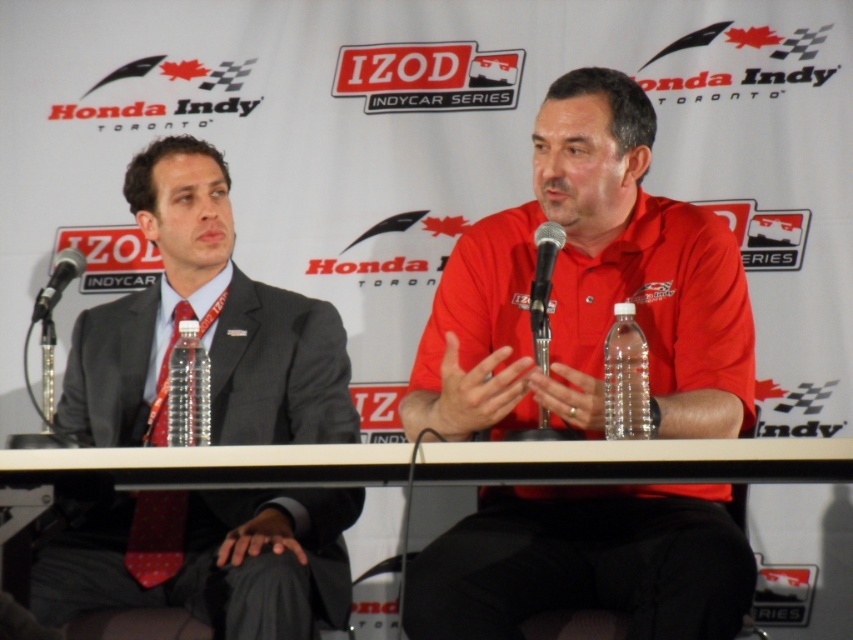
Does clear plastic bottle at center have a larger size compared to metallic silver microphone at center?

Indeed, clear plastic bottle at center has a larger size compared to metallic silver microphone at center.

Measure the distance from clear plastic bottle at center to metallic silver microphone at center.

clear plastic bottle at center and metallic silver microphone at center are 7.37 inches apart.

Measure the distance between clear plastic bottle at center and camera.

clear plastic bottle at center and camera are 2.42 meters apart from each other.

The height and width of the screenshot is (640, 853). What are the coordinates of `clear plastic bottle at center` in the screenshot? It's located at click(x=625, y=378).

Who is higher up, red dotted tie at left or black metallic microphone at left?

black metallic microphone at left

Describe the element at coordinates (155, 536) in the screenshot. The width and height of the screenshot is (853, 640). I see `red dotted tie at left` at that location.

I want to click on red dotted tie at left, so click(x=155, y=536).

Does matte red shirt at center appear under black metallic microphone at left?

Yes, matte red shirt at center is below black metallic microphone at left.

Which is above, matte red shirt at center or black metallic microphone at left?

black metallic microphone at left is above.

Between point (635, 131) and point (62, 282), which one is positioned behind?

The point (635, 131) is behind.

Find the location of a particular element. matte red shirt at center is located at coordinates (589, 289).